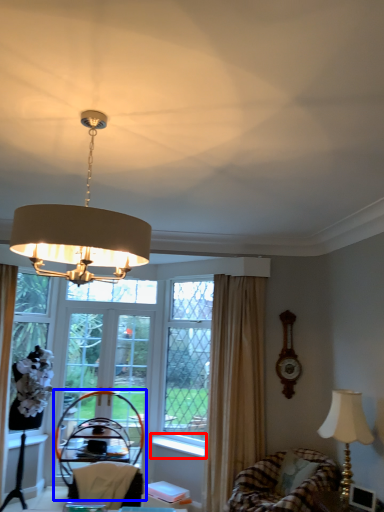
Question: Which object appears farthest to the camera in this image, window sill (highlighted by a red box) or armchair (highlighted by a blue box)?

Choices:
 (A) window sill
 (B) armchair

Answer: (A)